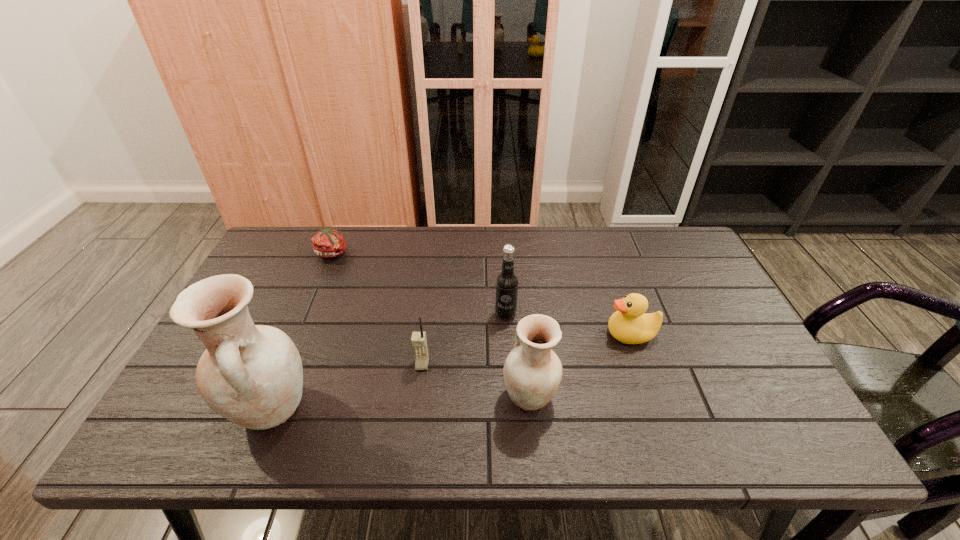
In order to click on tomato positioned at the left edge in this screenshot , I will do `click(327, 243)`.

Image resolution: width=960 pixels, height=540 pixels. I want to click on object present at the far left corner, so click(x=327, y=243).

Identify the location of object that is at the near left corner. The height and width of the screenshot is (540, 960). (252, 375).

This screenshot has width=960, height=540. Find the location of `vacant region at the far edge of the desktop`. vacant region at the far edge of the desktop is located at coordinates (384, 242).

Find the location of `free space at the near edge of the desktop`. free space at the near edge of the desktop is located at coordinates (380, 413).

The height and width of the screenshot is (540, 960). What are the coordinates of `free region at the left edge of the desktop` in the screenshot? It's located at [x=293, y=274].

This screenshot has width=960, height=540. Find the location of `vacant space at the right edge`. vacant space at the right edge is located at coordinates (658, 281).

In order to click on blank space at the far left corner of the desktop in this screenshot , I will do `click(311, 227)`.

The height and width of the screenshot is (540, 960). Find the location of `vacant space at the far right corner of the desktop`. vacant space at the far right corner of the desktop is located at coordinates (675, 235).

At what (x,y) coordinates should I click in order to perform the action: click on vacant space that is in between the third nearest object and the shorter pottery. Please return your answer as a coordinate pair (x, y). This screenshot has width=960, height=540. Looking at the image, I should click on (476, 381).